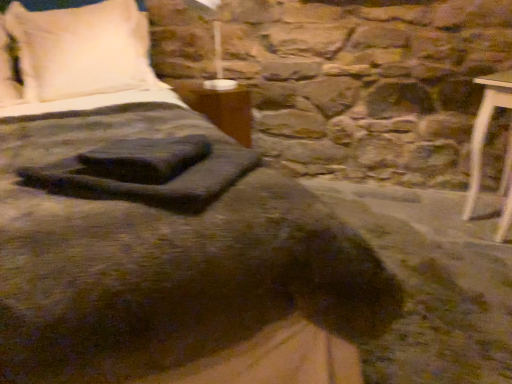
Question: Can you confirm if white soft pillow at upper left is taller than wooden table at center?

Choices:
 (A) yes
 (B) no

Answer: (A)

Question: Would you consider white soft pillow at upper left to be distant from wooden table at center?

Choices:
 (A) no
 (B) yes

Answer: (A)

Question: Is white soft pillow at upper left placed right next to wooden table at center?

Choices:
 (A) yes
 (B) no

Answer: (B)

Question: From a real-world perspective, is white soft pillow at upper left physically below wooden table at center?

Choices:
 (A) no
 (B) yes

Answer: (A)

Question: Is wooden table at center at the back of white soft pillow at upper left?

Choices:
 (A) yes
 (B) no

Answer: (B)

Question: Can you confirm if white soft pillow at upper left is shorter than wooden table at center?

Choices:
 (A) yes
 (B) no

Answer: (B)

Question: From the image's perspective, is matte white lampshade at upper center below white soft pillow at upper left?

Choices:
 (A) yes
 (B) no

Answer: (A)

Question: Would you consider matte white lampshade at upper center to be distant from white soft pillow at upper left?

Choices:
 (A) yes
 (B) no

Answer: (B)

Question: Is matte white lampshade at upper center positioned behind white soft pillow at upper left?

Choices:
 (A) no
 (B) yes

Answer: (A)

Question: Can you see matte white lampshade at upper center touching white soft pillow at upper left?

Choices:
 (A) yes
 (B) no

Answer: (B)

Question: Is matte white lampshade at upper center at the left side of white soft pillow at upper left?

Choices:
 (A) yes
 (B) no

Answer: (B)

Question: From a real-world perspective, is matte white lampshade at upper center on white soft pillow at upper left?

Choices:
 (A) no
 (B) yes

Answer: (B)

Question: From a real-world perspective, is matte white lampshade at upper center physically below wooden table at center?

Choices:
 (A) no
 (B) yes

Answer: (A)